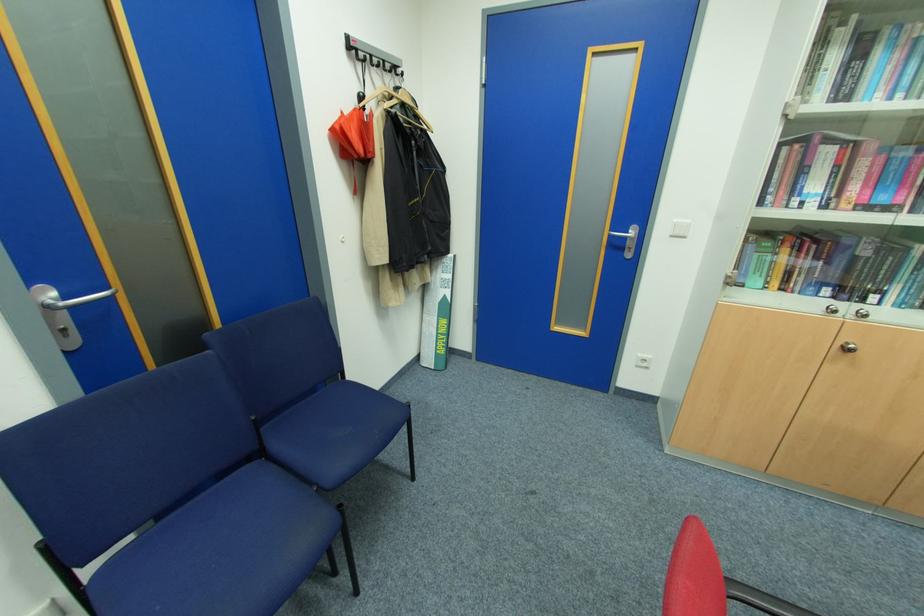
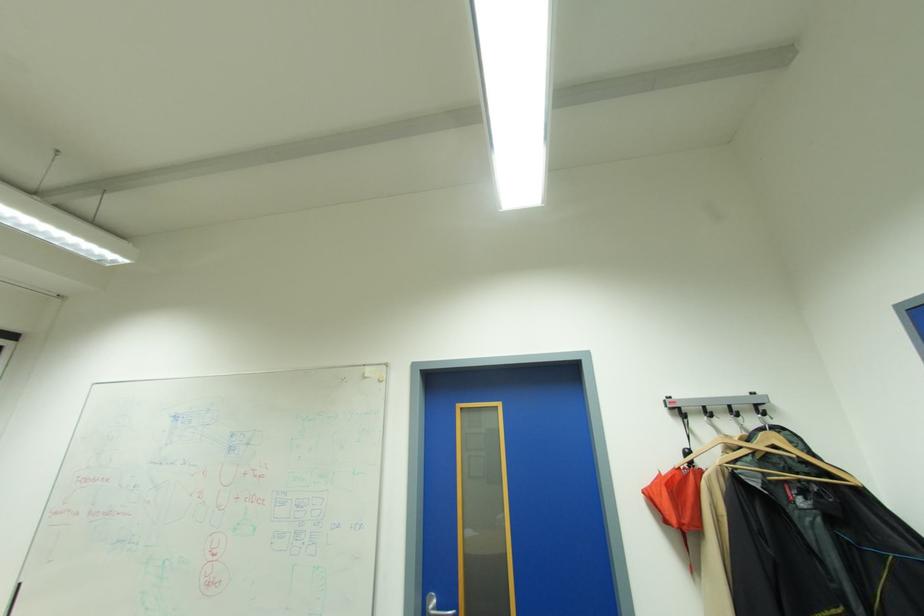
First-person continuous shooting, in which direction is the camera rotating?

The camera rotated toward left-up.